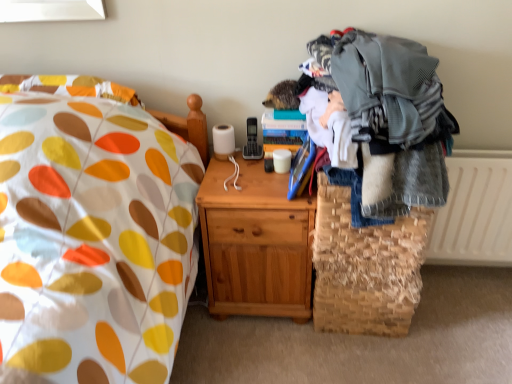
Question: Can we say gray knitted sweater at right lies outside light brown wood nightstand at center?

Choices:
 (A) yes
 (B) no

Answer: (A)

Question: Is gray knitted sweater at right oriented away from light brown wood nightstand at center?

Choices:
 (A) yes
 (B) no

Answer: (B)

Question: Would you consider gray knitted sweater at right to be distant from light brown wood nightstand at center?

Choices:
 (A) yes
 (B) no

Answer: (B)

Question: Is gray knitted sweater at right closer to camera compared to light brown wood nightstand at center?

Choices:
 (A) yes
 (B) no

Answer: (A)

Question: Is gray knitted sweater at right aimed at light brown wood nightstand at center?

Choices:
 (A) yes
 (B) no

Answer: (B)

Question: Is gray knitted sweater at right to the left of light brown wood nightstand at center from the viewer's perspective?

Choices:
 (A) yes
 (B) no

Answer: (B)

Question: Considering the relative positions of light brown wood nightstand at center and white textured radiator at right in the image provided, is light brown wood nightstand at center to the right of white textured radiator at right from the viewer's perspective?

Choices:
 (A) yes
 (B) no

Answer: (B)

Question: Does light brown wood nightstand at center lie behind white textured radiator at right?

Choices:
 (A) yes
 (B) no

Answer: (B)

Question: Considering the relative sizes of light brown wood nightstand at center and white textured radiator at right in the image provided, is light brown wood nightstand at center taller than white textured radiator at right?

Choices:
 (A) yes
 (B) no

Answer: (A)

Question: Are light brown wood nightstand at center and white textured radiator at right beside each other?

Choices:
 (A) no
 (B) yes

Answer: (A)

Question: Is light brown wood nightstand at center far from white textured radiator at right?

Choices:
 (A) yes
 (B) no

Answer: (B)

Question: Is light brown wood nightstand at center positioned before white textured radiator at right?

Choices:
 (A) no
 (B) yes

Answer: (B)

Question: Is white textured radiator at right next to woven straw basket at lower right and touching it?

Choices:
 (A) yes
 (B) no

Answer: (B)